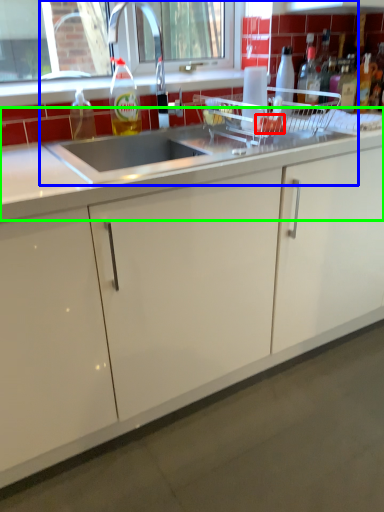
Question: Which object is positioned farthest from food (highlighted by a red box)? Select from sink (highlighted by a blue box) and countertop (highlighted by a green box).

Choices:
 (A) sink
 (B) countertop

Answer: (B)